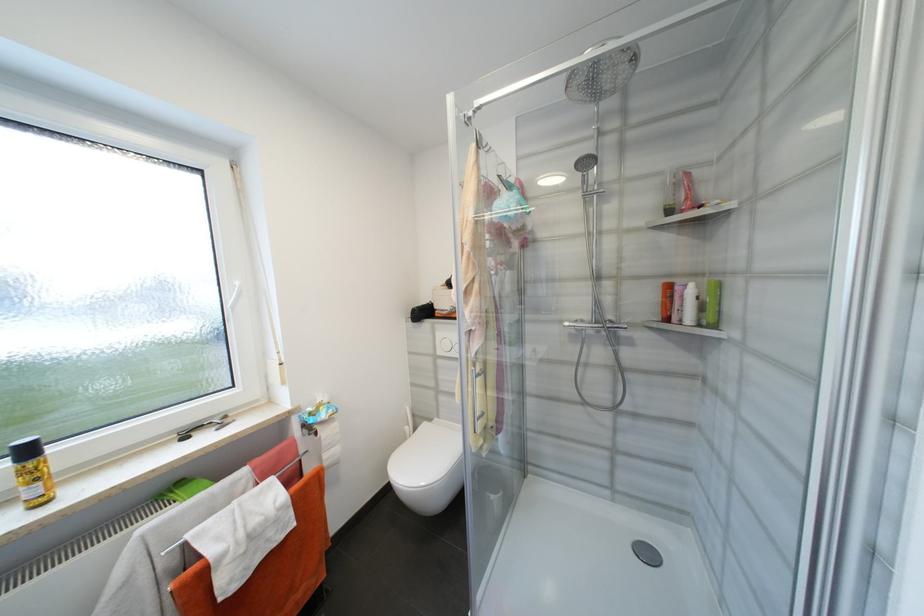
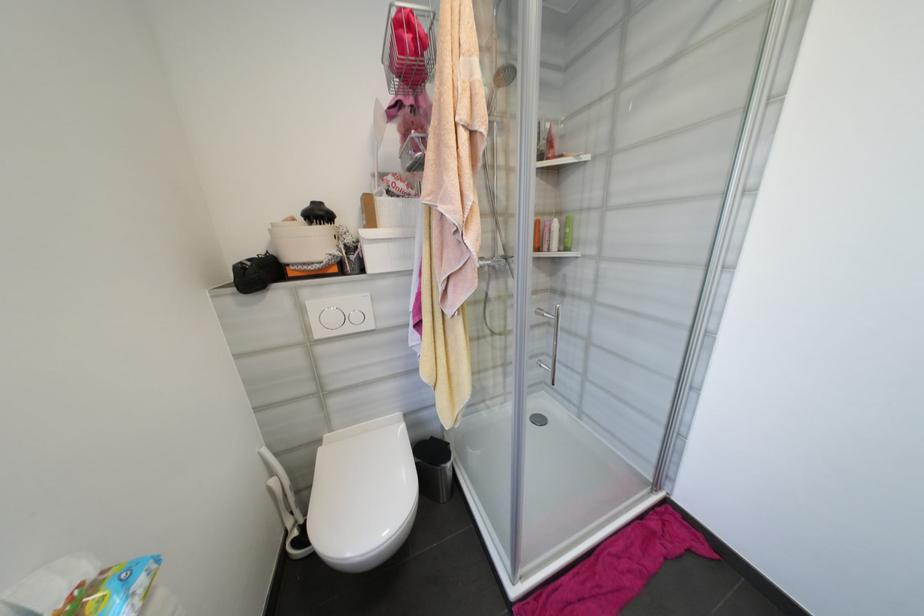
Question: How did the camera likely rotate?

Choices:
 (A) Left
 (B) Right
 (C) Up
 (D) Down

Answer: (B)